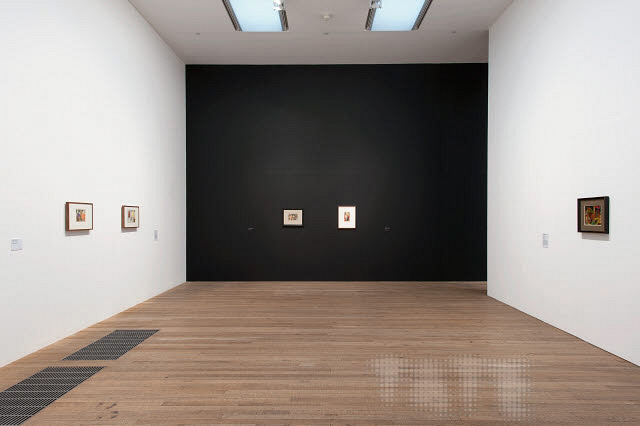
This screenshot has width=640, height=426. Find the location of `2 left walls`. 2 left walls is located at coordinates (64, 102), (579, 107).